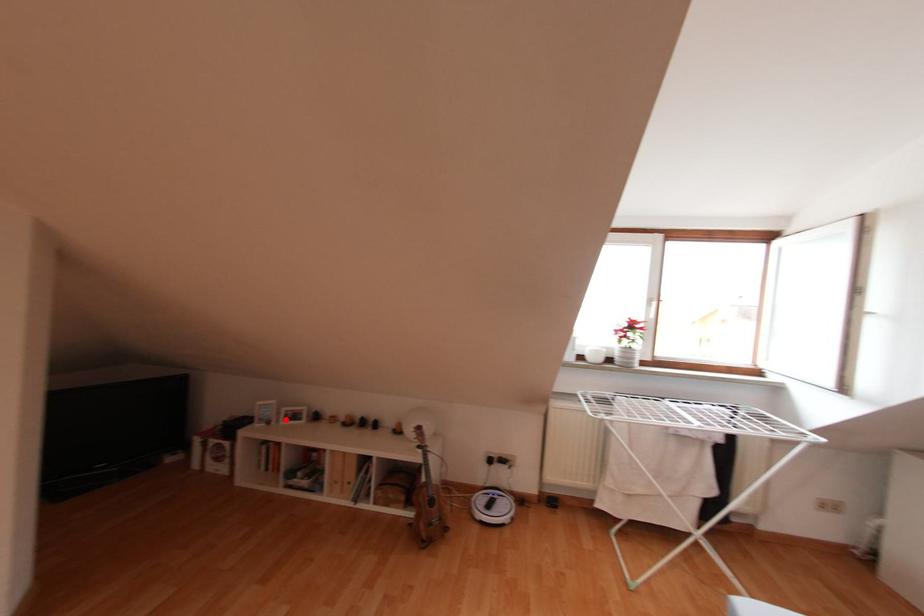
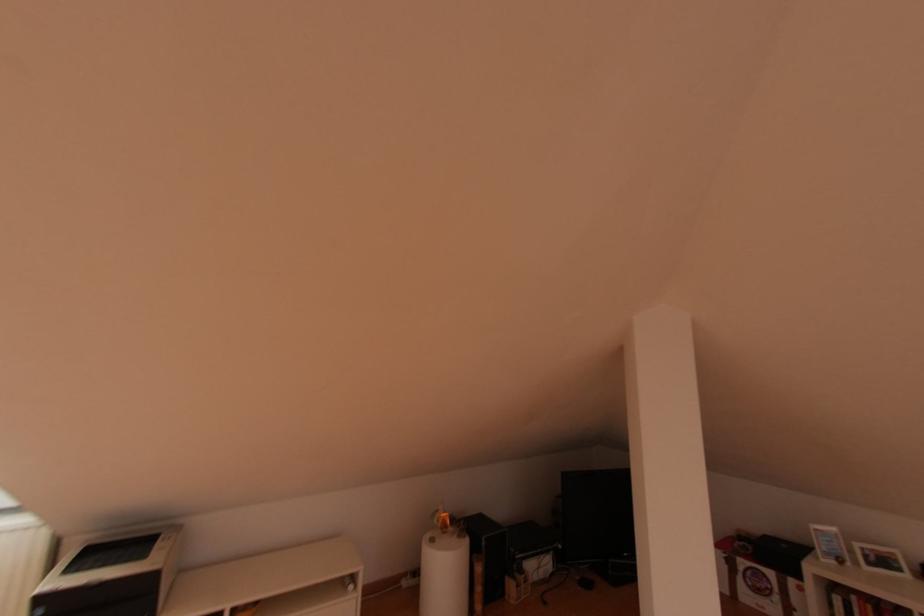
Locate, in the second image, the point that corresponds to the highlighted location in the first image.

(869, 564)